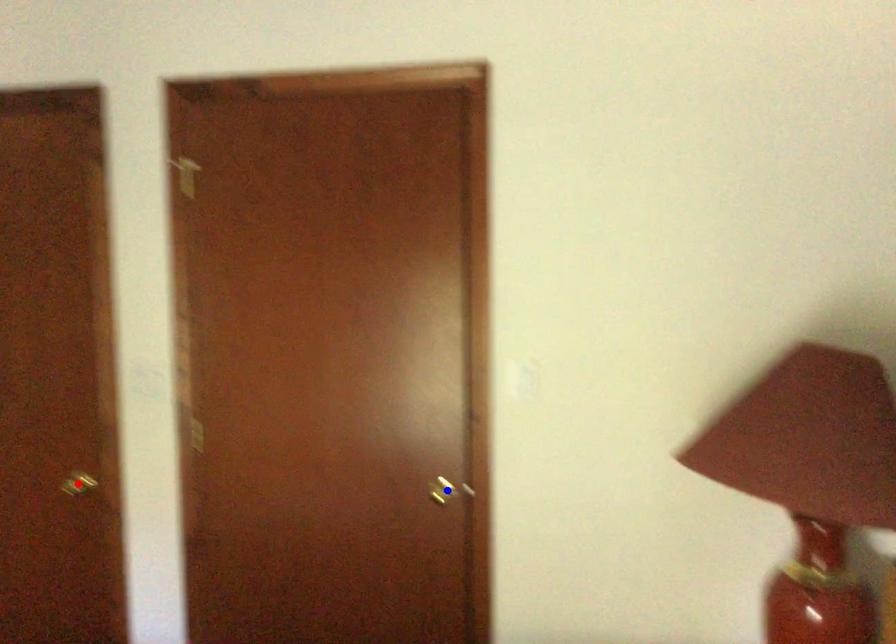
Question: Two points are marked on the image. Which point is closer to the camera?

Choices:
 (A) Blue point is closer.
 (B) Red point is closer.

Answer: (A)